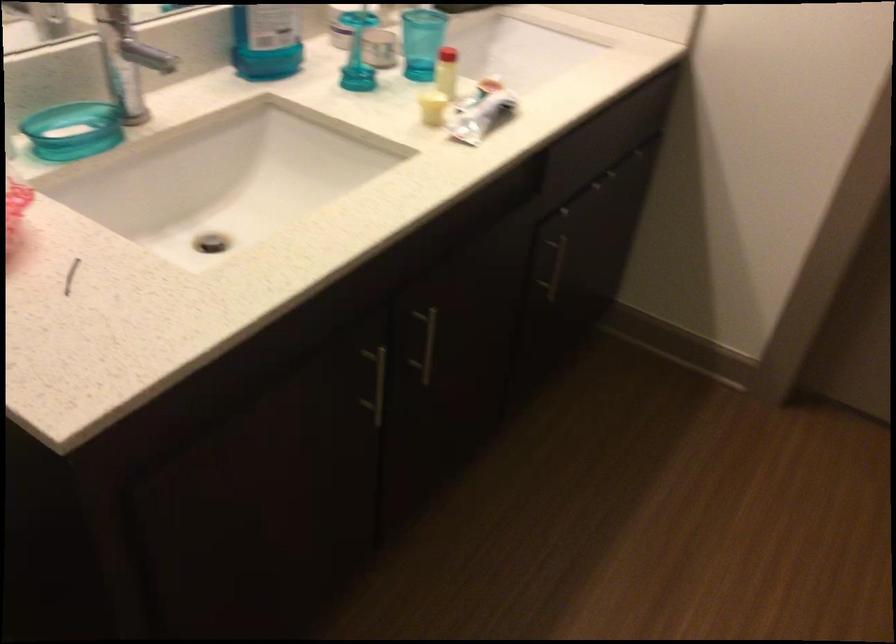
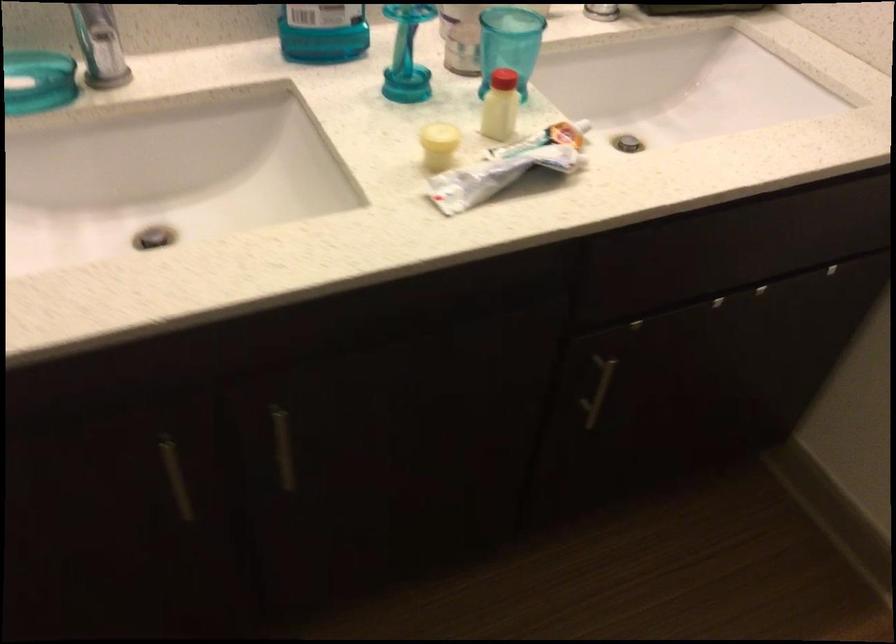
Question: The camera is either moving clockwise (left) or counter-clockwise (right) around the object. The first image is from the beginning of the video and the second image is from the end. Is the camera moving left or right when shooting the video?

Choices:
 (A) Left
 (B) Right

Answer: (B)